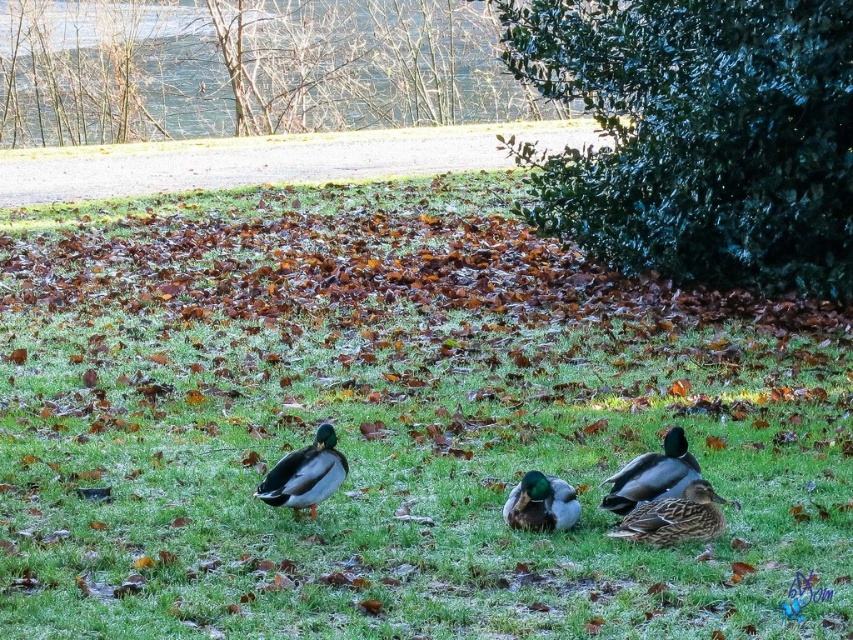
Between point (337, 467) and point (550, 484), which one is positioned in front?

Point (550, 484) is more forward.

Does point (276, 477) come closer to viewer compared to point (556, 492)?

No, (276, 477) is further to viewer.

What are the coordinates of `green glossy duck at center` in the screenshot? It's located at point(305,474).

Is green glossy duck at center above brown matte duck at lower right?

Yes, green glossy duck at center is above brown matte duck at lower right.

From the picture: Which is more to the right, green glossy duck at center or brown matte duck at lower right?

From the viewer's perspective, brown matte duck at lower right appears more on the right side.

Who is more forward, (292, 477) or (613, 529)?

Positioned in front is point (292, 477).

This screenshot has width=853, height=640. Identify the location of green glossy duck at center. (305, 474).

Who is taller, green grassy at center or green matte duck at center?

Standing taller between the two is green grassy at center.

Is point (79, 477) positioned before point (514, 508)?

No.

Does point (508, 400) lie behind point (543, 499)?

Yes, point (508, 400) is behind point (543, 499).

Locate an element on the screen. The height and width of the screenshot is (640, 853). green grassy at center is located at coordinates (393, 422).